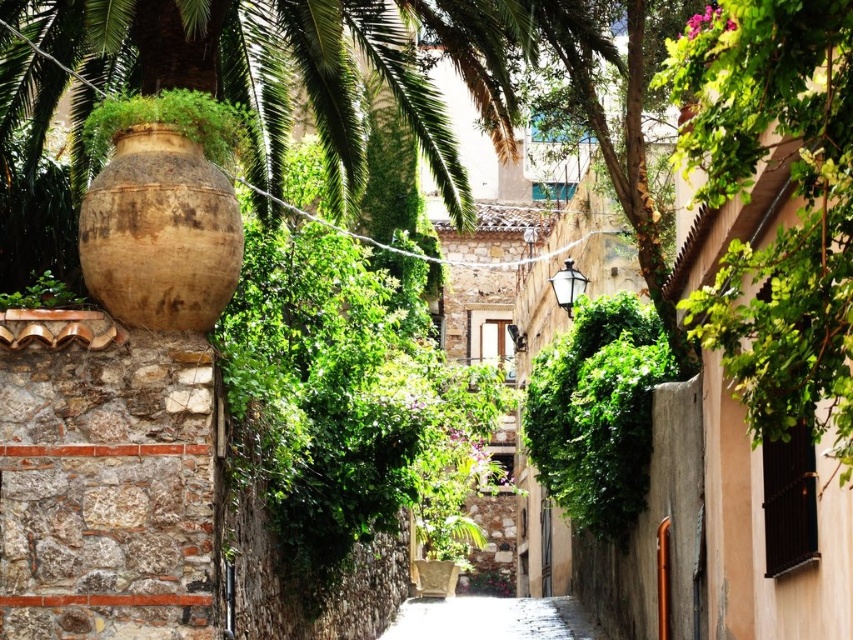
Question: Which point is closer to the camera?

Choices:
 (A) (608, 332)
 (B) (566, 618)

Answer: (A)

Question: Which of the following is the closest to the observer?

Choices:
 (A) smooth stone alley at center
 (B) green leafy plant at center

Answer: (B)

Question: Which point is farther from the camera taking this photo?

Choices:
 (A) (653, 358)
 (B) (448, 637)

Answer: (B)

Question: Does green leafy plant at center have a lesser width compared to smooth stone alley at center?

Choices:
 (A) no
 (B) yes

Answer: (B)

Question: Can you confirm if green leafy plant at center is thinner than smooth stone alley at center?

Choices:
 (A) no
 (B) yes

Answer: (B)

Question: Is green leafy plant at center thinner than smooth stone alley at center?

Choices:
 (A) no
 (B) yes

Answer: (B)